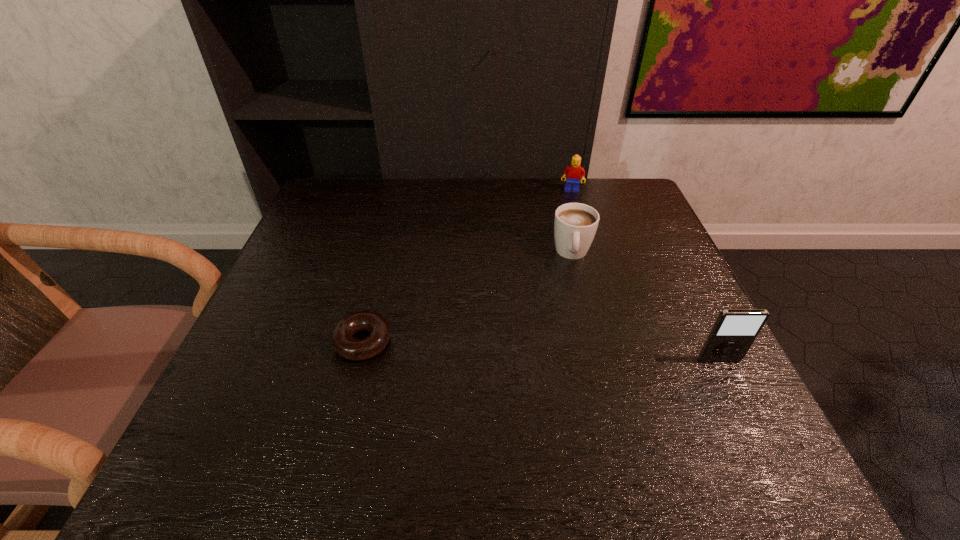
Identify the location of vacant space at the left edge of the desktop. (300, 360).

Locate an element on the screen. The width and height of the screenshot is (960, 540). free region at the right edge is located at coordinates (642, 242).

The height and width of the screenshot is (540, 960). I want to click on vacant space at the far left corner, so click(x=331, y=188).

This screenshot has height=540, width=960. In the image, there is a desktop. Identify the location of free space at the far right corner. (645, 216).

Where is `empty space that is in between the shortest object and the farthest object`? The image size is (960, 540). empty space that is in between the shortest object and the farthest object is located at coordinates (468, 266).

In order to click on vacant area between the leftmost object and the cappuccino in this screenshot , I will do `click(468, 298)`.

Image resolution: width=960 pixels, height=540 pixels. What are the coordinates of `free area in between the shortest object and the third nearest object` in the screenshot? It's located at (468, 298).

The height and width of the screenshot is (540, 960). Find the location of `empty space between the shortest object and the iPod`. empty space between the shortest object and the iPod is located at coordinates (541, 351).

Image resolution: width=960 pixels, height=540 pixels. In order to click on vacant area between the Lego and the leftmost object in this screenshot , I will do `click(468, 266)`.

This screenshot has height=540, width=960. Find the location of `empty space that is in between the shortest object and the cappuccino`. empty space that is in between the shortest object and the cappuccino is located at coordinates (468, 298).